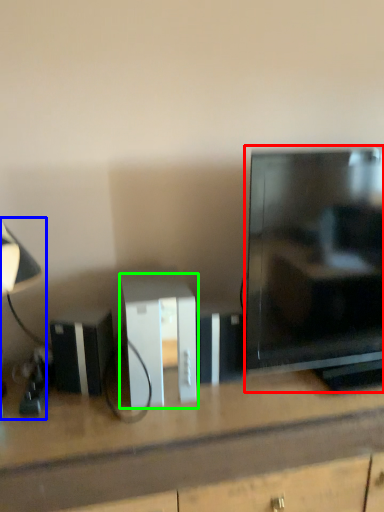
Question: Which is farther away from television (highlighted by a red box)? table lamp (highlighted by a blue box) or cabinetry (highlighted by a green box)?

Choices:
 (A) table lamp
 (B) cabinetry

Answer: (A)